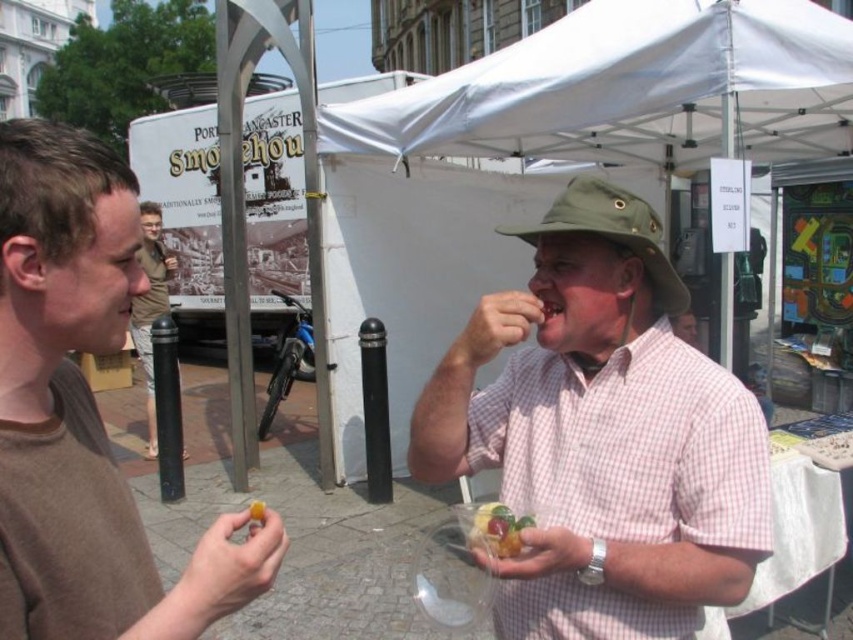
You are standing at the camera position and want to know how far the point marked as point [431,429] is from you. Can you determine the distance?

The point marked as point [431,429] is 1.68 meters away from the camera position.

In the scene shown: You are standing at the camera position observing the two points in the scene. Which point, point [695,416] or point [251,500], is nearer to you?

Point [695,416] is closer to the camera than point [251,500], so the point [695,416] is nearer to you.

In the scene shown: Based on the scene description, where is the pink checkered shirt at center located in terms of coordinates?

The pink checkered shirt at center is located at coordinates point (602, 435).